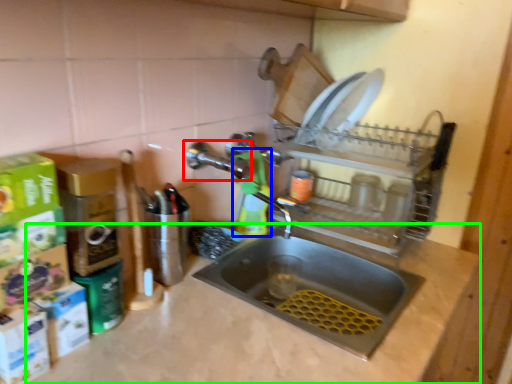
Question: Which object is positioned farthest from tap (highlighted by a red box)? Select from cleaning product (highlighted by a blue box) and counter top (highlighted by a green box).

Choices:
 (A) cleaning product
 (B) counter top

Answer: (B)